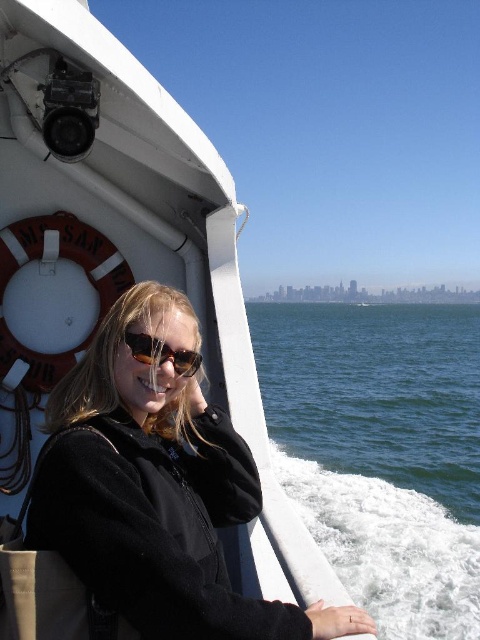
Does point (292, 449) come behind point (163, 348)?

Yes, it is.

Is blue water at lower right taller than matte black sunglasses at center?

Yes.

Is point (434, 404) in front of point (166, 353)?

No.

Locate an element on the screen. This screenshot has width=480, height=640. blue water at lower right is located at coordinates (382, 451).